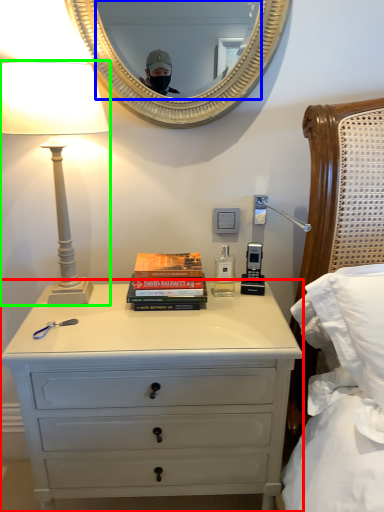
Question: Estimate the real-world distances between objects in this image. Which object is farther from chest of drawers (highlighted by a red box), mirror (highlighted by a blue box) or lamp (highlighted by a green box)?

Choices:
 (A) mirror
 (B) lamp

Answer: (A)